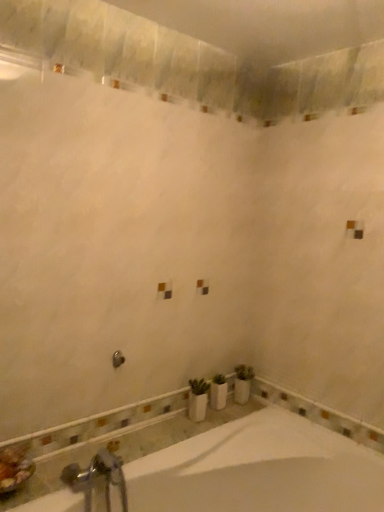
Question: Considering the relative sizes of brushed metal shower at center and white ceramic vase at lower center in the image provided, is brushed metal shower at center taller than white ceramic vase at lower center?

Choices:
 (A) yes
 (B) no

Answer: (B)

Question: Is brushed metal shower at center facing away from white ceramic vase at lower center?

Choices:
 (A) yes
 (B) no

Answer: (B)

Question: From a real-world perspective, is brushed metal shower at center over white ceramic vase at lower center?

Choices:
 (A) no
 (B) yes

Answer: (B)

Question: Does brushed metal shower at center appear on the right side of white ceramic vase at lower center?

Choices:
 (A) yes
 (B) no

Answer: (B)

Question: Would you consider brushed metal shower at center to be distant from white ceramic vase at lower center?

Choices:
 (A) no
 (B) yes

Answer: (A)

Question: Is silver metallic faucet at lower left spatially inside white ceramic vase at lower center, or outside of it?

Choices:
 (A) outside
 (B) inside

Answer: (A)

Question: In terms of height, does silver metallic faucet at lower left look taller or shorter compared to white ceramic vase at lower center?

Choices:
 (A) short
 (B) tall

Answer: (B)

Question: Would you say silver metallic faucet at lower left is to the left or to the right of white ceramic vase at lower center in the picture?

Choices:
 (A) left
 (B) right

Answer: (A)

Question: From the image's perspective, is silver metallic faucet at lower left above or below white ceramic vase at lower center?

Choices:
 (A) above
 (B) below

Answer: (B)

Question: Choose the correct answer: Is white ceramic vase at lower center inside white glossy bathtub at lower center or outside it?

Choices:
 (A) inside
 (B) outside

Answer: (B)

Question: Is point (241, 373) closer or farther from the camera than point (306, 484)?

Choices:
 (A) farther
 (B) closer

Answer: (A)

Question: Considering the positions of white ceramic vase at lower center and white glossy bathtub at lower center in the image, is white ceramic vase at lower center bigger or smaller than white glossy bathtub at lower center?

Choices:
 (A) small
 (B) big

Answer: (A)

Question: Visually, is white ceramic vase at lower center positioned to the left or to the right of white glossy bathtub at lower center?

Choices:
 (A) left
 (B) right

Answer: (B)

Question: From their relative heights in the image, would you say white glossy bathtub at lower center is taller or shorter than brushed metal shower at center?

Choices:
 (A) short
 (B) tall

Answer: (B)

Question: From the image's perspective, is white glossy bathtub at lower center positioned above or below brushed metal shower at center?

Choices:
 (A) below
 (B) above

Answer: (A)